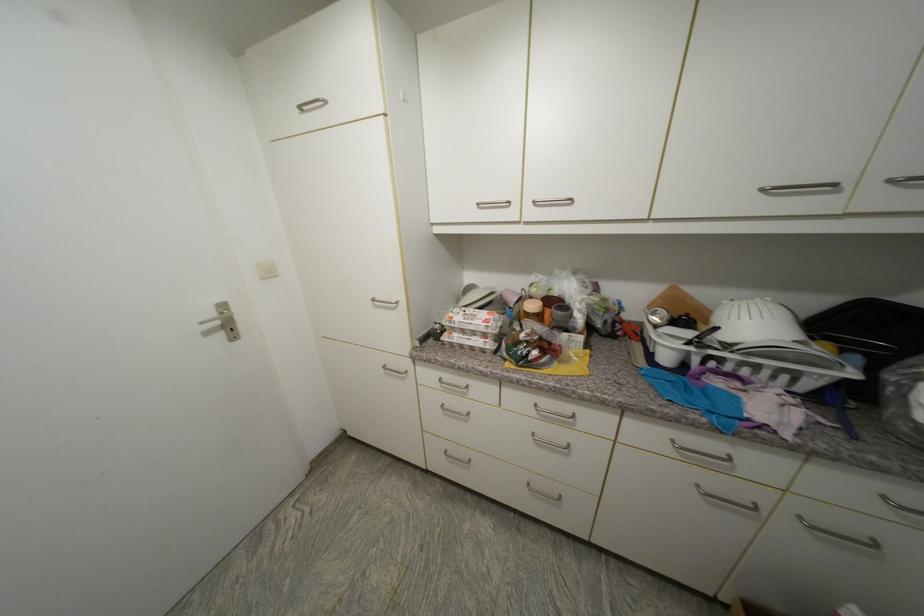
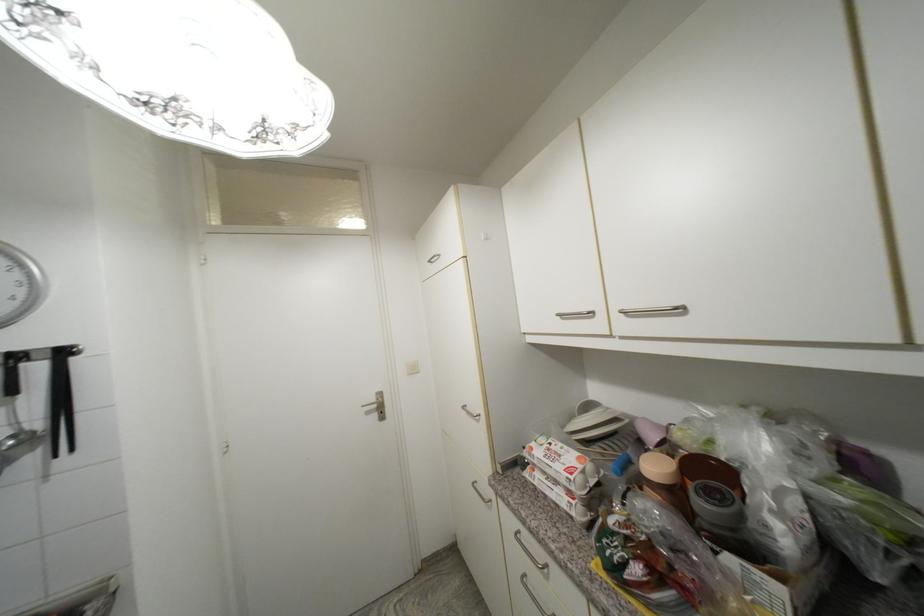
First-person continuous shooting, in which direction is the camera rotating?

The camera's rotation is toward left-up.